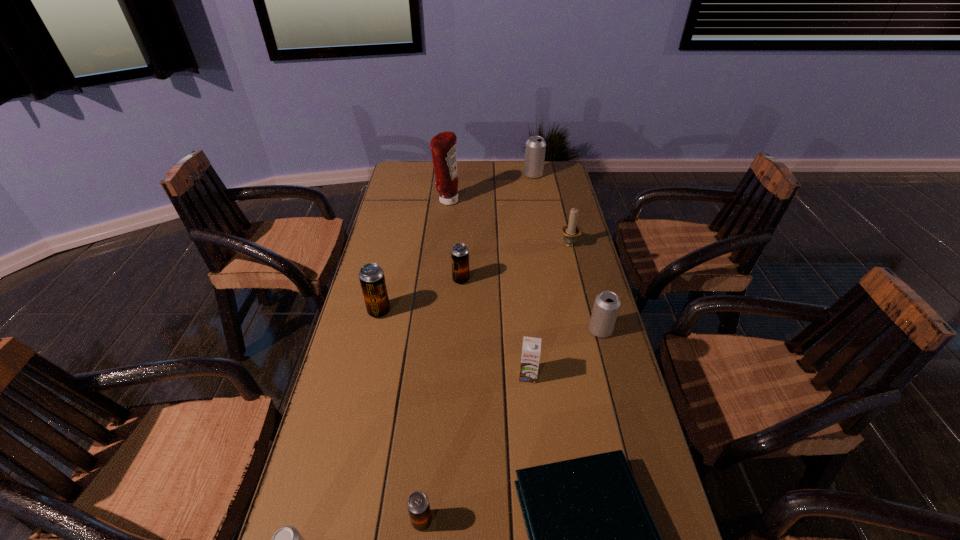
The height and width of the screenshot is (540, 960). What are the coordinates of `the tallest object` in the screenshot? It's located at (443, 146).

Where is `red condiment`? This screenshot has height=540, width=960. red condiment is located at coordinates (443, 146).

Image resolution: width=960 pixels, height=540 pixels. I want to click on the second white beer can from right to left, so click(x=535, y=148).

The image size is (960, 540). Identify the location of the fifth beer can from left to right. (535, 148).

Find the location of a particular element. the fourth nearest beer can is located at coordinates (371, 275).

Find the location of `the second nearest black beer can`. the second nearest black beer can is located at coordinates (371, 275).

You are a GUI agent. You are given a task and a screenshot of the screen. Output one action in this format:
    pyautogui.click(x=<x>, y=<y>)
    Task: Click on the eighth nearest object
    Image resolution: width=960 pixels, height=540 pixels.
    Given the screenshot: What is the action you would take?
    pyautogui.click(x=571, y=231)

Locate an element on the screen. chocolate milk is located at coordinates (531, 349).

The image size is (960, 540). Identify the location of brown chocolate milk. (531, 349).

At what (x,y) coordinates should I click in order to perform the action: click on the rightmost black beer can. Please return your answer as a coordinate pair (x, y). The image size is (960, 540). Looking at the image, I should click on (459, 253).